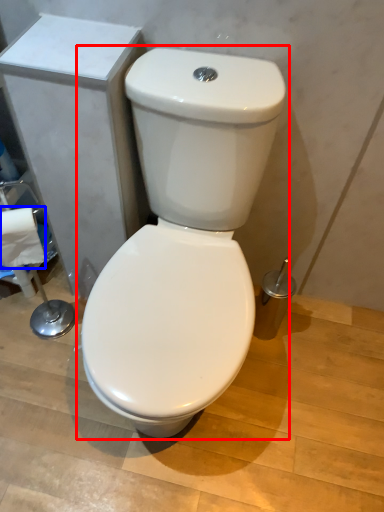
Question: Which point is further to the camera, toilet (highlighted by a red box) or toilet paper (highlighted by a blue box)?

Choices:
 (A) toilet
 (B) toilet paper

Answer: (B)